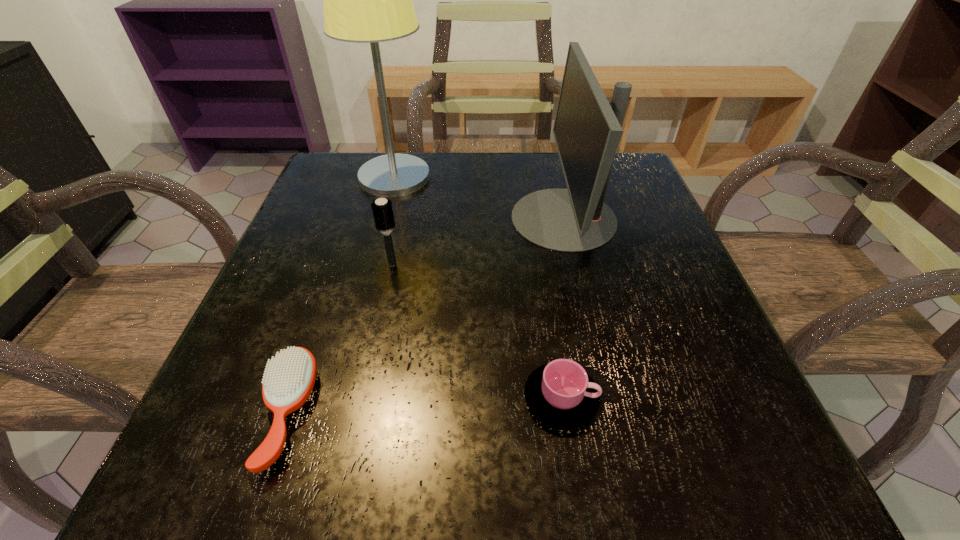
I want to click on object present at the right edge, so click(587, 130).

The image size is (960, 540). Identify the location of object present at the far left corner. (366, 0).

Locate an element on the screen. This screenshot has height=540, width=960. object that is at the near left corner is located at coordinates (289, 378).

At what (x,y) coordinates should I click in order to perform the action: click on object positioned at the far right corner. Please return your answer as a coordinate pair (x, y). The image size is (960, 540). Looking at the image, I should click on (587, 130).

Identify the location of free region at the far edge. (434, 195).

Where is `vacant space at the near edge of the desktop`? vacant space at the near edge of the desktop is located at coordinates (541, 427).

The image size is (960, 540). In the image, there is a desktop. Identify the location of vacant space at the left edge. (216, 376).

The height and width of the screenshot is (540, 960). I want to click on blank space at the right edge of the desktop, so click(x=644, y=225).

Identify the location of vacant region at the far left corner of the desktop. (316, 178).

This screenshot has height=540, width=960. I want to click on vacant region at the far right corner, so click(x=625, y=192).